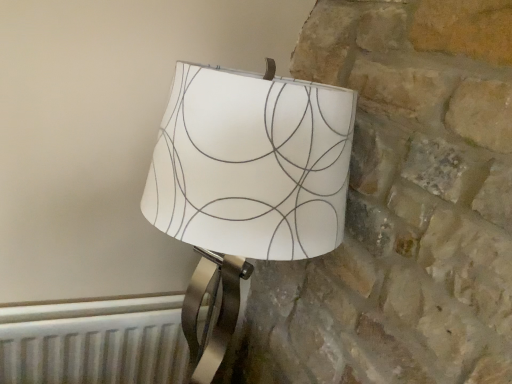
Question: Should I look upward or downward to see white paper lampshade at center?

Choices:
 (A) down
 (B) up

Answer: (A)

Question: From a real-world perspective, is white paper lampshade at center below white metallic radiator at lower left?

Choices:
 (A) yes
 (B) no

Answer: (B)

Question: Can you confirm if white paper lampshade at center is shorter than white metallic radiator at lower left?

Choices:
 (A) no
 (B) yes

Answer: (A)

Question: Is white paper lampshade at center to the right of white metallic radiator at lower left from the viewer's perspective?

Choices:
 (A) yes
 (B) no

Answer: (A)

Question: Is white paper lampshade at center wider than white metallic radiator at lower left?

Choices:
 (A) yes
 (B) no

Answer: (A)

Question: Is white paper lampshade at center smaller than white metallic radiator at lower left?

Choices:
 (A) yes
 (B) no

Answer: (B)

Question: Is white paper lampshade at center bigger than white metallic radiator at lower left?

Choices:
 (A) yes
 (B) no

Answer: (A)

Question: Can you confirm if white metallic radiator at lower left is smaller than white paper lampshade at center?

Choices:
 (A) yes
 (B) no

Answer: (A)

Question: Is white metallic radiator at lower left positioned behind white paper lampshade at center?

Choices:
 (A) no
 (B) yes

Answer: (B)

Question: Is white metallic radiator at lower left outside of white paper lampshade at center?

Choices:
 (A) yes
 (B) no

Answer: (A)

Question: Is white metallic radiator at lower left directly adjacent to white paper lampshade at center?

Choices:
 (A) yes
 (B) no

Answer: (B)

Question: From the image's perspective, does white metallic radiator at lower left appear lower than white paper lampshade at center?

Choices:
 (A) no
 (B) yes

Answer: (B)

Question: Would you say white paper lampshade at center is part of white metallic radiator at lower left's contents?

Choices:
 (A) yes
 (B) no

Answer: (B)

Question: Does point (202, 87) appear closer or farther from the camera than point (77, 324)?

Choices:
 (A) farther
 (B) closer

Answer: (B)